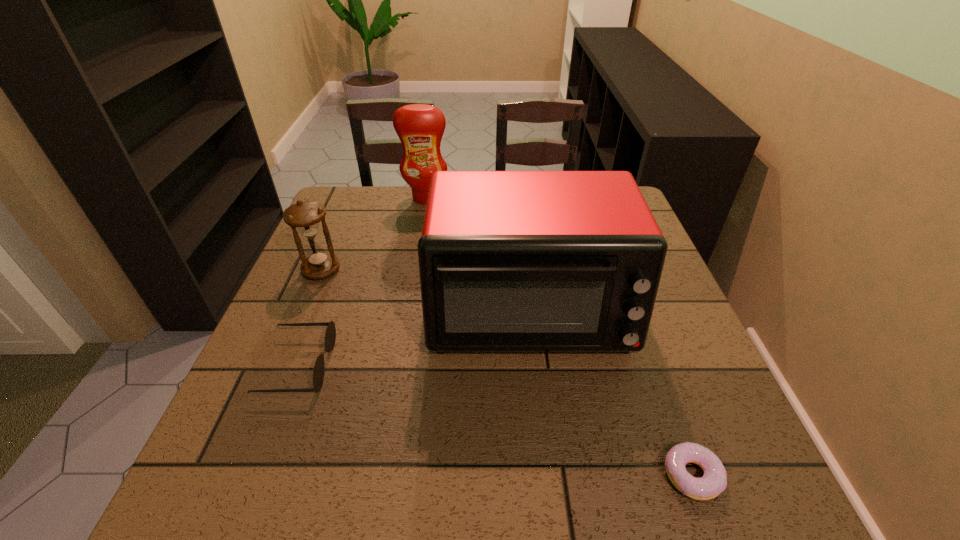
Find the location of a particular element. The width and height of the screenshot is (960, 540). vacant space at the right edge of the desktop is located at coordinates (703, 434).

Locate an element on the screen. blank space at the far left corner of the desktop is located at coordinates (352, 188).

The height and width of the screenshot is (540, 960). What are the coordinates of `vacant region between the farthest object and the fourth tallest object` in the screenshot? It's located at (362, 282).

What are the coordinates of `vacant space in between the hourglass and the sunglasses` in the screenshot? It's located at (310, 318).

Where is `free space between the doughnut and the third tallest object`? free space between the doughnut and the third tallest object is located at coordinates (507, 373).

The width and height of the screenshot is (960, 540). In order to click on free space that is in between the shortest object and the toaster oven in this screenshot , I will do `click(611, 393)`.

Identify the location of unoccupied area between the hourglass and the condiment. This screenshot has height=540, width=960. (373, 234).

Locate an element on the screen. free space between the fourth tallest object and the toaster oven is located at coordinates (414, 338).

The image size is (960, 540). Identify the location of free space between the toaster oven and the sunglasses. (414, 338).

The width and height of the screenshot is (960, 540). I want to click on vacant area between the shortest object and the sunglasses, so tap(495, 421).